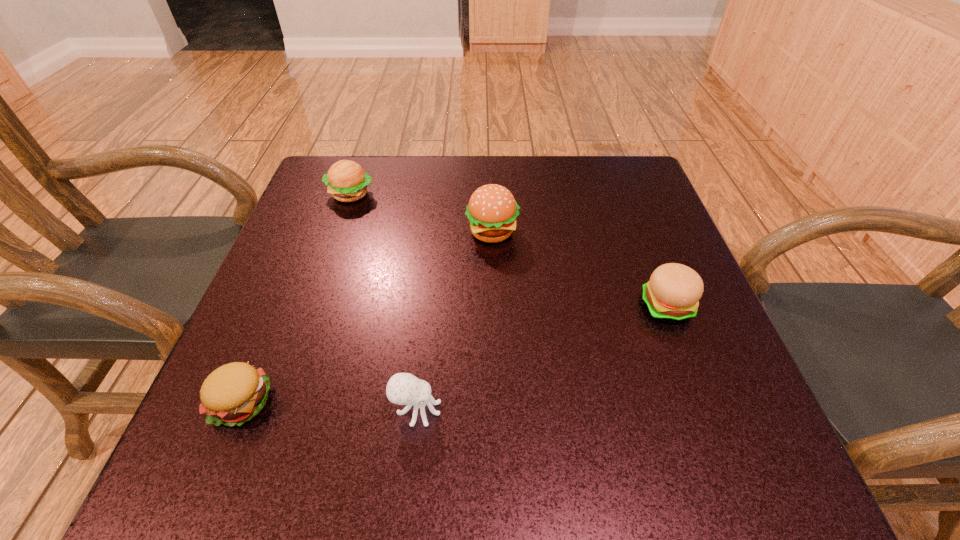
Locate an element on the screen. free space at the near edge of the desktop is located at coordinates (636, 428).

In the image, there is a desktop. At what (x,y) coordinates should I click in order to perform the action: click on free space at the left edge. Please return your answer as a coordinate pair (x, y). The height and width of the screenshot is (540, 960). Looking at the image, I should click on (280, 397).

Where is `free region at the right edge`? free region at the right edge is located at coordinates (658, 365).

This screenshot has height=540, width=960. I want to click on free space at the far left corner, so click(367, 211).

Where is `vacant space at the near left corner of the desktop`? Image resolution: width=960 pixels, height=540 pixels. vacant space at the near left corner of the desktop is located at coordinates (268, 464).

The height and width of the screenshot is (540, 960). What are the coordinates of `vacant area at the far right corner` in the screenshot? It's located at (588, 164).

I want to click on vacant space at the near right corner of the desktop, so click(x=761, y=460).

What are the coordinates of `free space that is in between the shortest hamburger and the second nearest hamburger` in the screenshot? It's located at pyautogui.click(x=454, y=354).

Locate an element on the screen. The height and width of the screenshot is (540, 960). free space that is in between the third farthest hamburger and the octopus is located at coordinates (541, 358).

At what (x,y) coordinates should I click in order to perform the action: click on free space between the third object from right to left and the rightmost hamburger. Please return your answer as a coordinate pair (x, y). The image size is (960, 540). Looking at the image, I should click on pos(541,358).